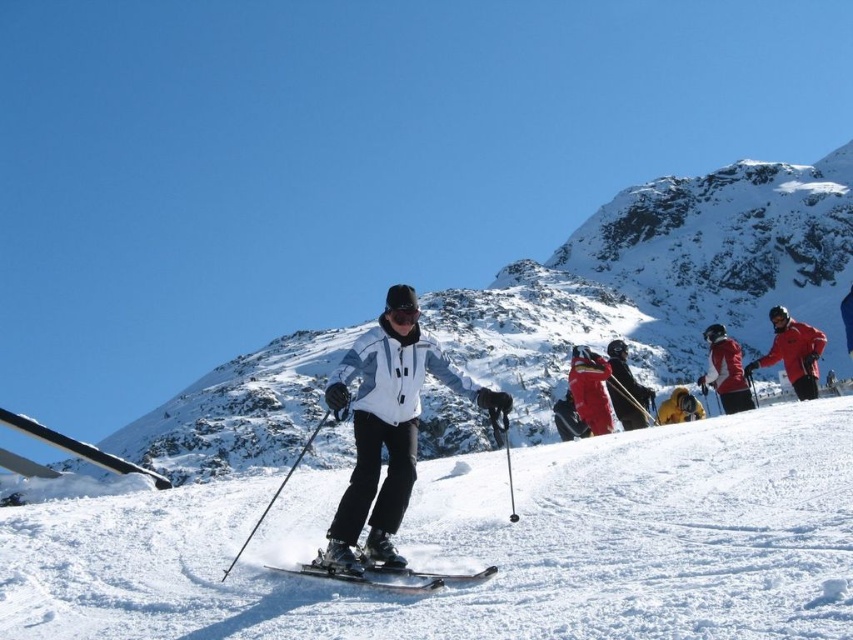
You are a photographer at the ski resort and want to capture both the matte red ski suit at center and the red fabric jacket at center right in a single photo. Which of the two objects should you focus on first to ensure they are both in frame?

The matte red ski suit at center is smaller than the red fabric jacket at center right, so you should focus on the red fabric jacket at center right first to ensure both are in frame.